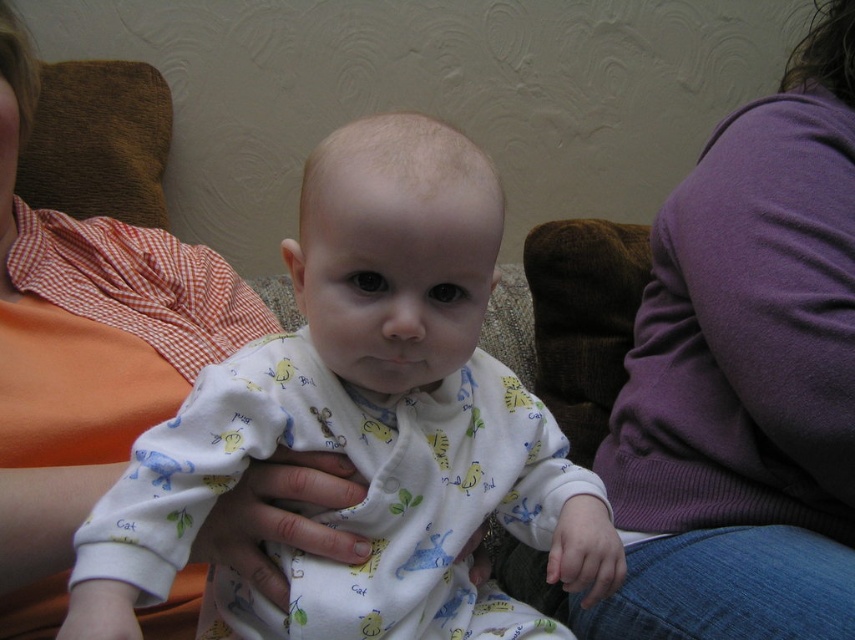
You are a photographer trying to capture a closeup of the white cotton onesie at center. Given that the camera lens can only focus on objects within a 0.5 unit radius from the center point at coordinates point (364,422). Will the white cotton onesie at center be in focus?

The point (364,422) corresponds to the white cotton onesie at center, so yes, the white cotton onesie at center will be in focus since it is exactly at the center point within the 0.5 unit radius.

You are a photographer taking a family photo. You need to ensure the white cotton onesie at center and the purple sweater at upper right are both in focus. Since the camera can only focus on one subject at a time, which object should you prioritize focusing on to ensure both are sharp?

You should focus on the white cotton onesie at center because it is closer to the camera than the purple sweater at upper right. Since it is positioned to the left of the purple sweater, adjusting focus here will help keep both in focus by using the depth of field appropriately.

Looking at this image, you are a photographer taking a picture of the baby in the center. The camera you are using has a focus point at coordinate point (x=364, y=422). Which object will the camera focus on?

The point (x=364, y=422) corresponds to the white cotton onesie at center, so the camera will focus on the white cotton onesie at center.